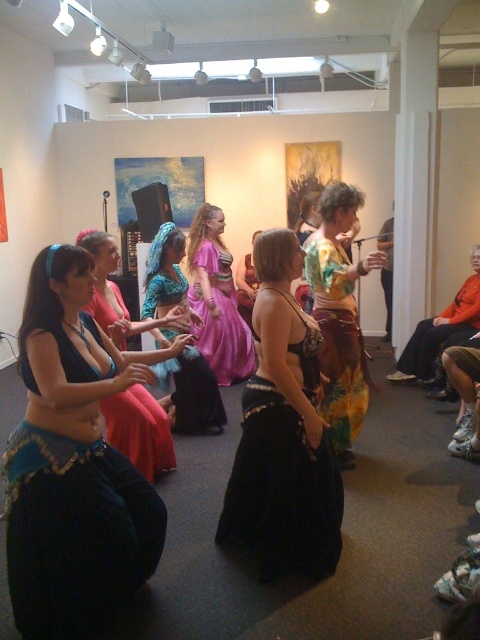
You are a photographer standing at the back of the room. You want to capture a photo of the black satin skirt at center and the shiny blue fabric belly dancer at center. Which object should you focus on first if you want to include both in the frame without moving the camera?

You should focus on the shiny blue fabric belly dancer at center first because the black satin skirt at center might be wider than it, so positioning the wider object in the center can help fit both into the frame.

You are a photographer in the art gallery trying to capture a photo of both the black satin skirt at center and the shiny blue fabric belly dancer at center. From your current position, which one is on the left?

The shiny blue fabric belly dancer at center is on the left because the black satin skirt at center is positioned on the right side of it.

You are standing at the entrance of the art gallery and see the blue satin belly dancer at center. If you want to walk directly towards them, which direction should you move? Please provide your answer in terms of compass directions like north, south, east, or west, or cardinal directions like northeast, northwest, etc.

The blue satin belly dancer at center is located at coordinates point (x=72, y=467). Since the x and y coordinates are both positive, this position is in the southeast direction from your current position at the entrance. Therefore, you should move towards the southeast to reach them.